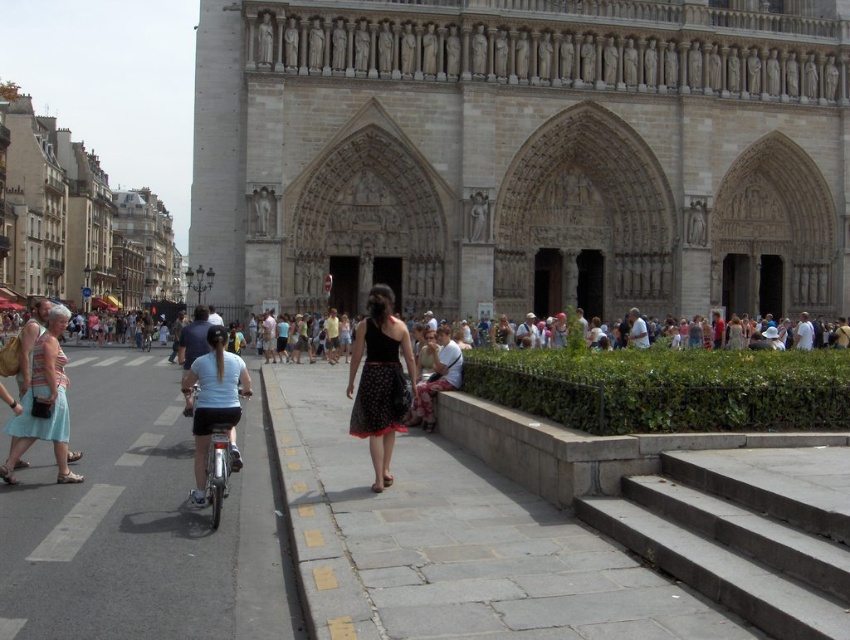
Between stone gothic cathedral at center and gray concrete stairs at lower right, which one has more height?

stone gothic cathedral at center is taller.

Does stone gothic cathedral at center appear over gray concrete stairs at lower right?

Indeed, stone gothic cathedral at center is positioned over gray concrete stairs at lower right.

Find the location of a particular element. stone gothic cathedral at center is located at coordinates (523, 152).

Does stone gothic cathedral at center appear on the left side of white asphalt at lower left?

No, stone gothic cathedral at center is not to the left of white asphalt at lower left.

From the picture: Is stone gothic cathedral at center below white asphalt at lower left?

Actually, stone gothic cathedral at center is above white asphalt at lower left.

Image resolution: width=850 pixels, height=640 pixels. What do you see at coordinates (523, 152) in the screenshot?
I see `stone gothic cathedral at center` at bounding box center [523, 152].

In order to click on stone gothic cathedral at center in this screenshot , I will do `click(523, 152)`.

Is white asphalt at lower left closer to camera compared to white matte bicycle at center-left?

Yes.

Can you confirm if white asphalt at lower left is shorter than white matte bicycle at center-left?

Correct, white asphalt at lower left is not as tall as white matte bicycle at center-left.

Which is behind, point (180, 497) or point (231, 374)?

The point (231, 374) is behind.

Image resolution: width=850 pixels, height=640 pixels. Find the location of `white asphalt at lower left`. white asphalt at lower left is located at coordinates (143, 525).